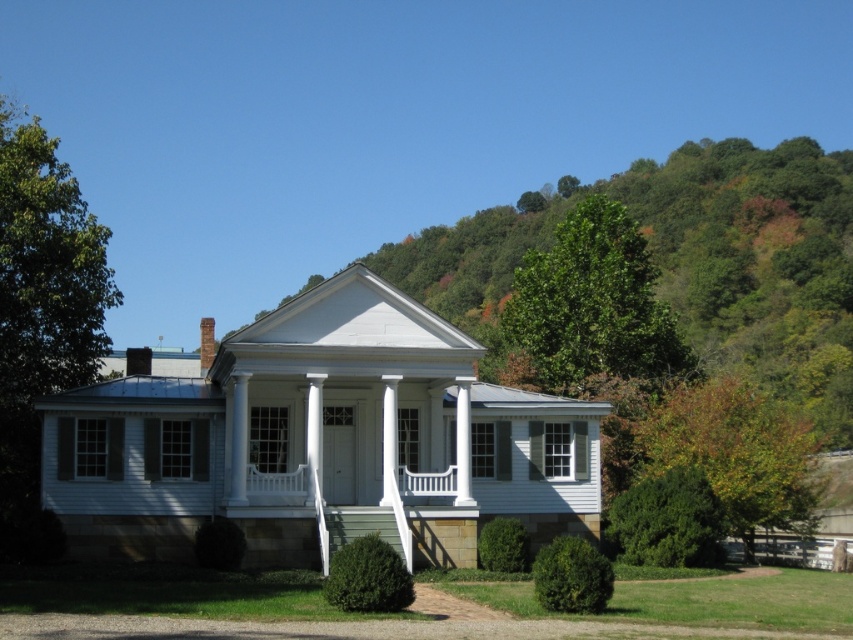
Is point (538, 372) in front of point (691, 422)?

No, it is not.

Who is shorter, green leafy tree at upper center or green leafy tree at right?

green leafy tree at right

Is point (621, 362) in front of point (788, 515)?

No, (621, 362) is behind (788, 515).

Where is `green leafy tree at upper center`? green leafy tree at upper center is located at coordinates (593, 305).

Can you confirm if green leafy hillside at upper center is thinner than green leafy tree at right?

Incorrect, green leafy hillside at upper center's width is not less than green leafy tree at right's.

Between green leafy hillside at upper center and green leafy tree at right, which one appears on the left side from the viewer's perspective?

green leafy tree at right is more to the left.

You are a GUI agent. You are given a task and a screenshot of the screen. Output one action in this format:
    pyautogui.click(x=<x>, y=<y>)
    Task: Click on the green leafy hillside at upper center
    
    Given the screenshot: What is the action you would take?
    [688, 262]

Does point (752, 208) come farther from viewer compared to point (642, 324)?

Yes, point (752, 208) is behind point (642, 324).

Does green leafy hillside at upper center have a lesser height compared to green leafy tree at upper center?

Incorrect, green leafy hillside at upper center's height does not fall short of green leafy tree at upper center's.

Does point (807, 177) come closer to viewer compared to point (563, 292)?

No, it is behind (563, 292).

Locate an element on the screen. This screenshot has height=640, width=853. green leafy hillside at upper center is located at coordinates (688, 262).